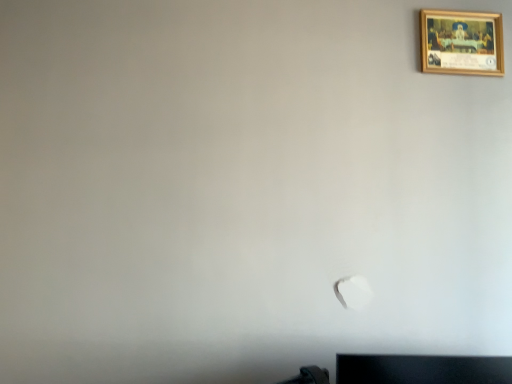
Question: Should I look upward or downward to see wooden picture frame at upper right?

Choices:
 (A) down
 (B) up

Answer: (B)